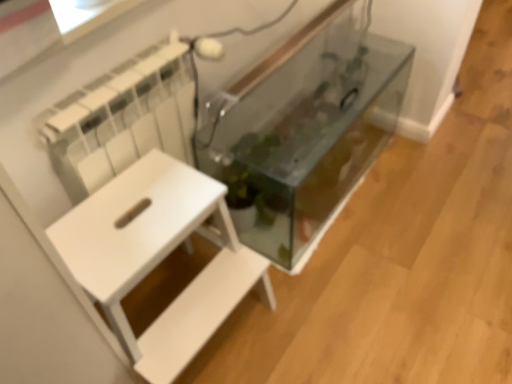
I want to click on vacant space in front of transparent glass tank at center, so click(x=375, y=293).